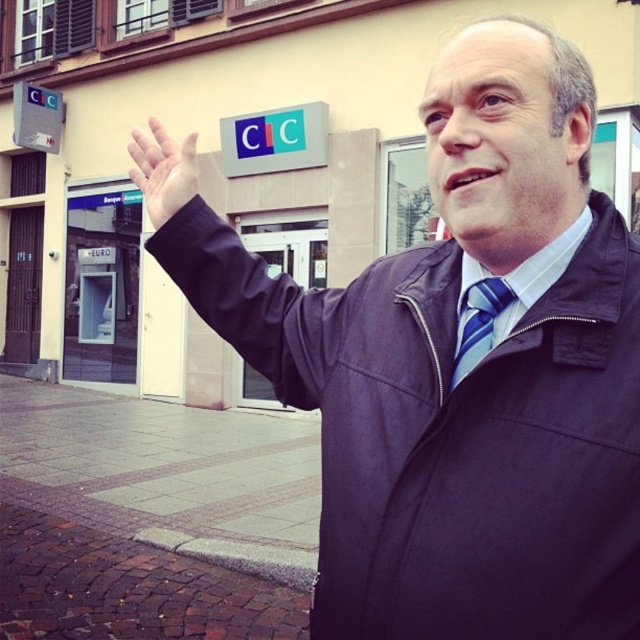
Who is lower down, blue striped tie at center or metallic gray sign at upper left?

blue striped tie at center is lower down.

Locate an element on the screen. This screenshot has width=640, height=640. blue striped tie at center is located at coordinates (477, 323).

In order to click on blue striped tie at center in this screenshot , I will do `click(477, 323)`.

Measure the distance between black leather arm at upper center and camera.

They are 1.22 meters apart.

Who is positioned more to the right, black leather arm at upper center or blue striped tie at center?

From the viewer's perspective, blue striped tie at center appears more on the right side.

Where is `black leather arm at upper center`? This screenshot has width=640, height=640. black leather arm at upper center is located at coordinates (225, 272).

Looking at this image, who is higher up, black leather arm at upper center or metallic gray sign at upper left?

Positioned higher is metallic gray sign at upper left.

Who is more distant from viewer, (211, 216) or (45, 90)?

Point (45, 90)

The height and width of the screenshot is (640, 640). What are the coordinates of `black leather arm at upper center` in the screenshot? It's located at (225, 272).